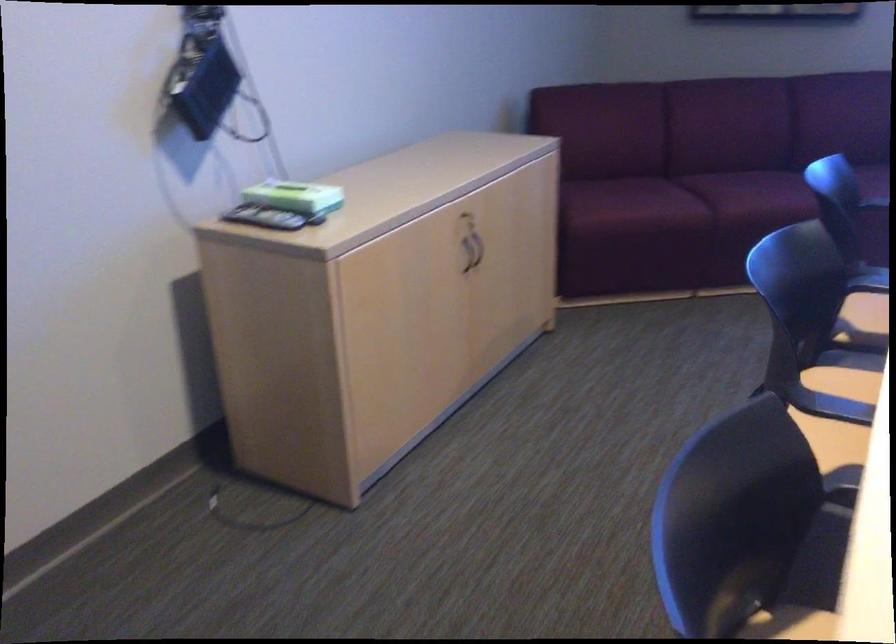
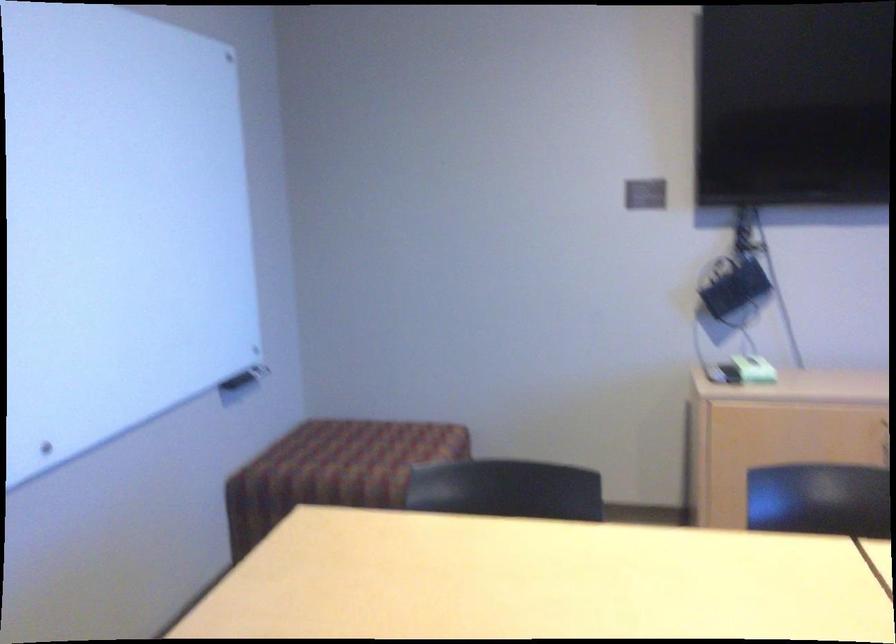
In the second image, find the point that corresponds to the point at 325,196 in the first image.

(754, 368)